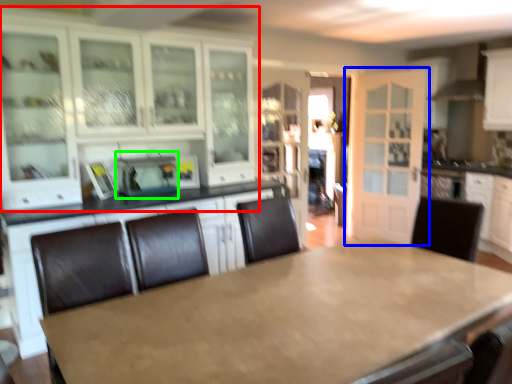
Question: Which object is positioned closest to cabinetry (highlighted by a red box)? Select from door (highlighted by a blue box) and appliance (highlighted by a green box).

Choices:
 (A) door
 (B) appliance

Answer: (B)